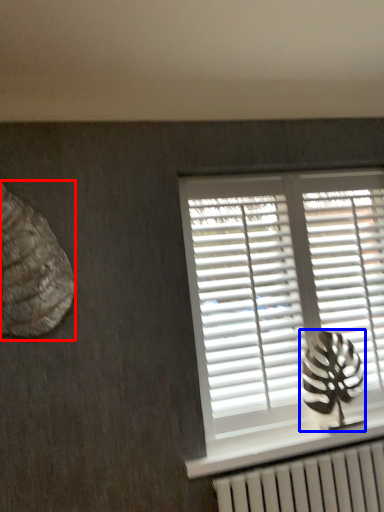
Question: Which object is further to the camera taking this photo, animal (highlighted by a red box) or animal (highlighted by a blue box)?

Choices:
 (A) animal
 (B) animal

Answer: (B)